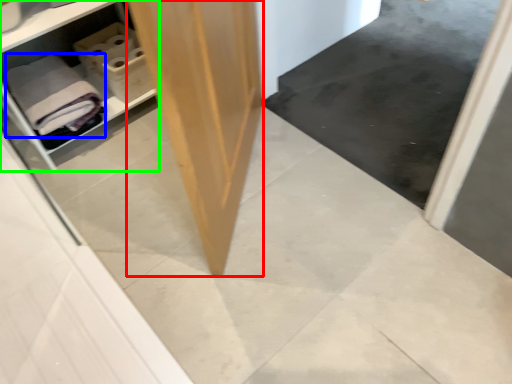
Question: Considering the real-world distances, which object is farthest from plywood (highlighted by a red box)? bath towel (highlighted by a blue box) or shelf (highlighted by a green box)?

Choices:
 (A) bath towel
 (B) shelf

Answer: (B)